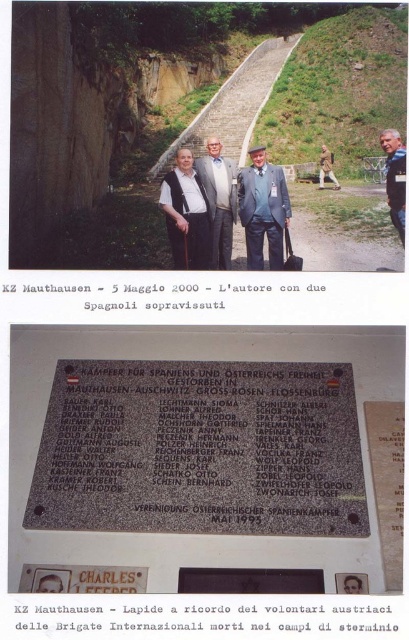
Question: Where is gold metallic plaque at center located in relation to light gray suit at center in the image?

Choices:
 (A) below
 (B) above

Answer: (A)

Question: Can you confirm if black metal plaque at center is wider than matte blue suit at center?

Choices:
 (A) yes
 (B) no

Answer: (A)

Question: Which object is the closest to the gray polished stone plaque at center?

Choices:
 (A) khaki fabric jacket at center
 (B) black metal plaque at center
 (C) matte black vest at center

Answer: (B)

Question: Which object is the closest to the gray polished stone plaque at center?

Choices:
 (A) light gray suit at center
 (B) matte black vest at center
 (C) matte blue suit at center

Answer: (B)

Question: Is matte blue suit at center below matte black vest at center?

Choices:
 (A) yes
 (B) no

Answer: (A)

Question: Which point is farther from the camera taking this photo?

Choices:
 (A) (206, 164)
 (B) (101, 580)

Answer: (A)